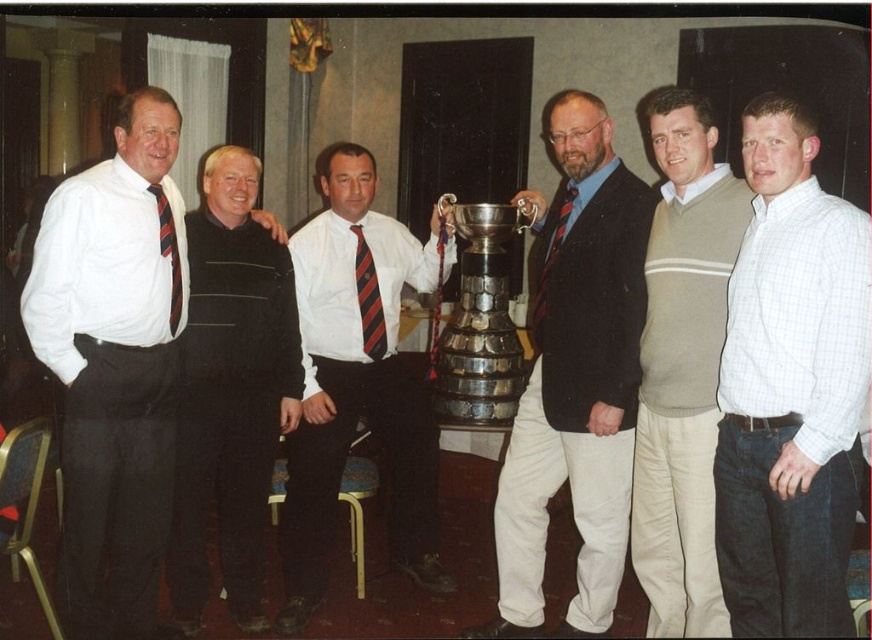
You are a photographer adjusting your camera settings. You notice the light brown sweater at center and the red striped tie at center. Which object should you focus on first to ensure both are in sharp focus?

The light brown sweater at center is closer to the viewer than the red striped tie at center. To ensure both are in sharp focus, focus on the light brown sweater at center first, as it is the closer object.

You are organizing a charity event and need to decide which tie to feature in promotional materials. The white shirt with striped tie at center and the red striped tie at center are both options. Based on their widths, which tie should you choose to ensure it stands out more visually?

The white shirt with striped tie at center has a greater width than the red striped tie at center, so selecting it would make the tie stand out more visually.

You are a photographer trying to adjust the lighting for the group photo. You need to ensure that the person wearing the white shirt with striped tie at center is well lit. Where should you position the main light relative to the other people in the group?

The white shirt with striped tie at center is positioned at point (358, 378), so the main light should be placed in front of and slightly to the side of this central position to evenly illuminate the subject while considering the group arrangement.